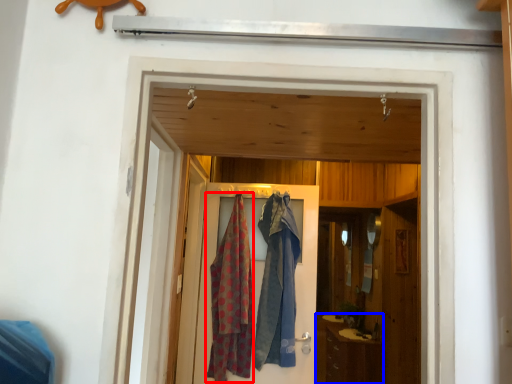
Question: Which of the following is the farthest to the observer, cloth (highlighted by a red box) or cabinetry (highlighted by a blue box)?

Choices:
 (A) cloth
 (B) cabinetry

Answer: (B)